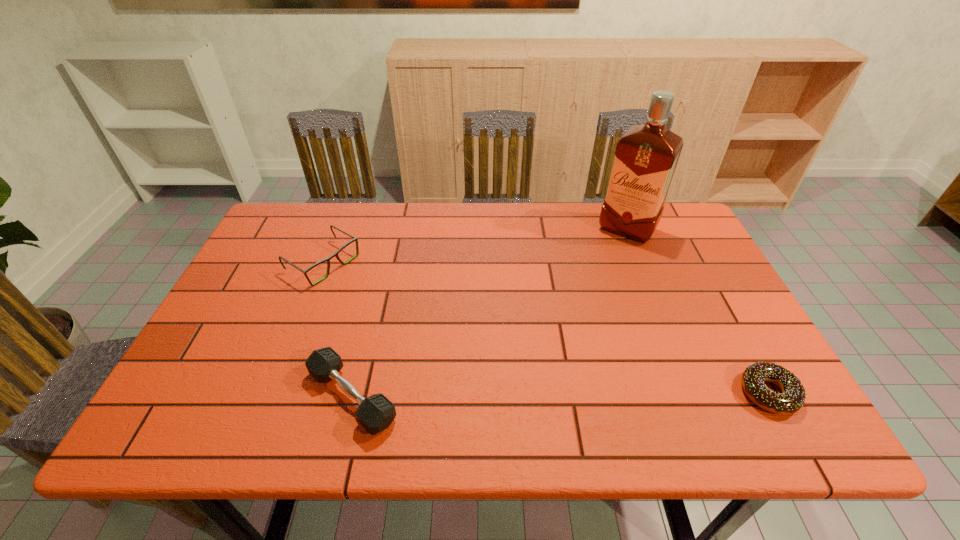
At what (x,y) coordinates should I click in order to perform the action: click on free location that satisfies the following two spatial constraints: 1. on the back side of the spectacles; 2. on the left side of the second object from right to left. Please return your answer as a coordinate pair (x, y). Image resolution: width=960 pixels, height=540 pixels. Looking at the image, I should click on (336, 230).

Locate an element on the screen. The height and width of the screenshot is (540, 960). free space that satisfies the following two spatial constraints: 1. on the back side of the dumbbell; 2. on the right side of the liquor is located at coordinates (393, 230).